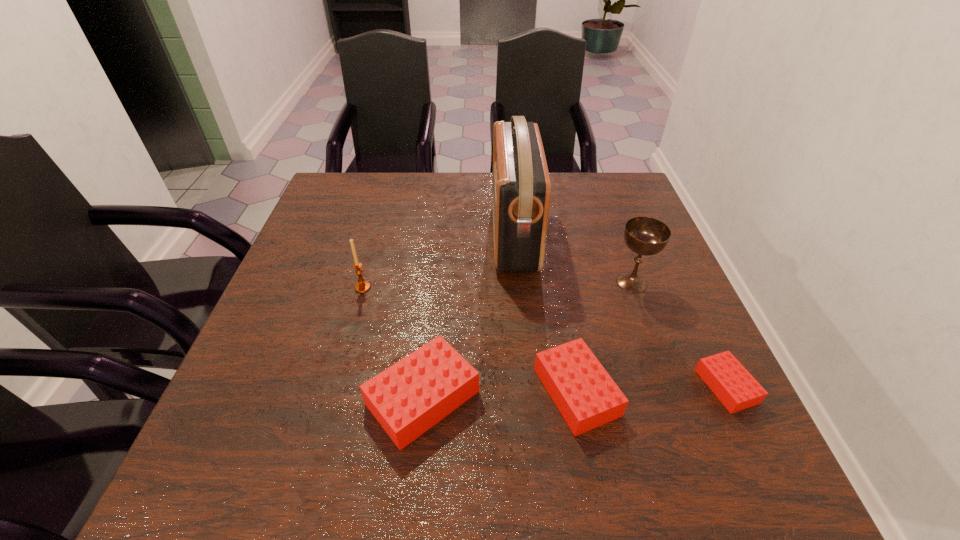
In order to click on free space between the fifth tallest object and the rightmost Lego in this screenshot , I will do `click(652, 389)`.

Locate an element on the screen. The height and width of the screenshot is (540, 960). empty space that is in between the shortest Lego and the second object from right to left is located at coordinates pyautogui.click(x=679, y=334).

The height and width of the screenshot is (540, 960). Find the location of `free space between the second shortest Lego and the fifth object from left to right`. free space between the second shortest Lego and the fifth object from left to right is located at coordinates (604, 337).

Locate an element on the screen. Image resolution: width=960 pixels, height=540 pixels. free space that is in between the candle_holder and the second object from right to left is located at coordinates (497, 285).

What are the coordinates of `unoccupied area between the shortest object and the second object from right to left` in the screenshot? It's located at (679, 334).

Where is `free spot between the second tallest Lego and the shortest object`? free spot between the second tallest Lego and the shortest object is located at coordinates (652, 389).

The height and width of the screenshot is (540, 960). Find the location of `object that is the fifth closest to the fifth tallest object`. object that is the fifth closest to the fifth tallest object is located at coordinates (362, 286).

Where is `object that stands as the third closest to the fifth object from left to right`? object that stands as the third closest to the fifth object from left to right is located at coordinates (734, 386).

Image resolution: width=960 pixels, height=540 pixels. In order to click on Lego that can be found as the closest to the second shortest Lego in this screenshot , I will do `click(408, 398)`.

Where is `Lego that can be found as the closest to the second tallest Lego`? This screenshot has width=960, height=540. Lego that can be found as the closest to the second tallest Lego is located at coordinates (408, 398).